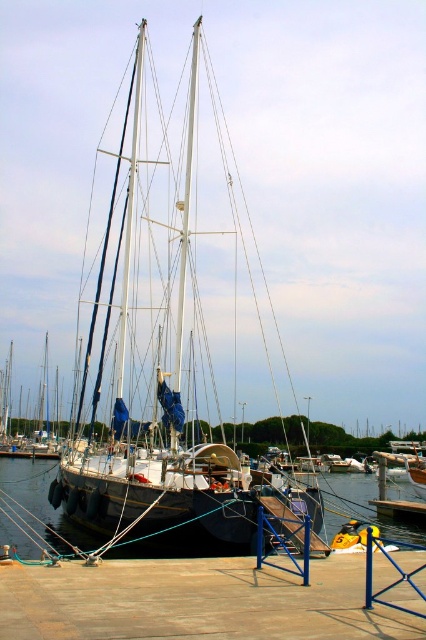
Between brown wooden dock at lower center and black rubber boat at center, which one is positioned higher?

brown wooden dock at lower center is above.

Can you confirm if brown wooden dock at lower center is positioned below black rubber boat at center?

Incorrect, brown wooden dock at lower center is not positioned below black rubber boat at center.

Does point (270, 627) come farther from viewer compared to point (37, 492)?

No.

Locate an element on the screen. The image size is (426, 640). brown wooden dock at lower center is located at coordinates (195, 602).

Does brown wooden dock at lower center appear on the left side of white matte sailboat at center?

No, brown wooden dock at lower center is not to the left of white matte sailboat at center.

In order to click on brown wooden dock at lower center in this screenshot , I will do `click(195, 602)`.

Between white matte sailboat at center and black rubber boat at center, which one has more height?

With more height is white matte sailboat at center.

The image size is (426, 640). What do you see at coordinates (164, 456) in the screenshot? I see `white matte sailboat at center` at bounding box center [164, 456].

Locate an element on the screen. This screenshot has height=640, width=426. white matte sailboat at center is located at coordinates 164,456.